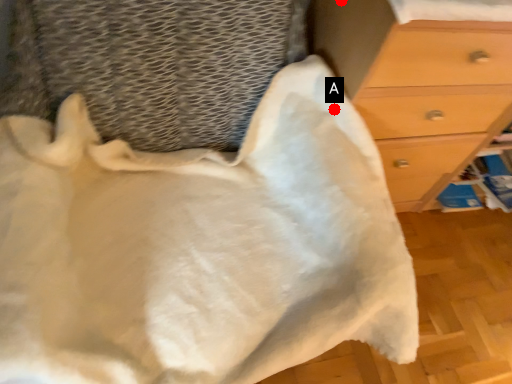
Question: Two points are circled on the image, labeled by A and B beside each circle. Which point is further to the camera?

Choices:
 (A) A is further
 (B) B is further

Answer: (A)